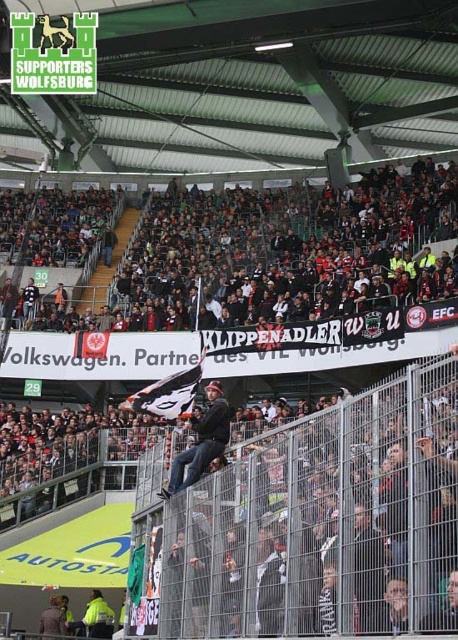
Who is more distant from viewer, (x=235, y=308) or (x=207, y=417)?

Positioned behind is point (x=235, y=308).

Which is in front, point (281, 268) or point (212, 435)?

Point (212, 435) is in front.

What do you see at coordinates (288, 248) in the screenshot? Image resolution: width=458 pixels, height=640 pixels. I see `dark gray fabric crowd at center` at bounding box center [288, 248].

Locate an element on the screen. dark gray fabric crowd at center is located at coordinates (288, 248).

In the scene shown: Does metallic silver fence at center have a lesser height compared to dark gray denim jacket at center?

Incorrect, metallic silver fence at center's height does not fall short of dark gray denim jacket at center's.

Between point (285, 464) and point (196, 426), which one is positioned in front?

Positioned in front is point (285, 464).

Where is `metallic silver fence at center`? The width and height of the screenshot is (458, 640). metallic silver fence at center is located at coordinates (315, 525).

Is metallic silver fence at center to the right of dark gray fabric crowd at center from the viewer's perspective?

Yes, metallic silver fence at center is to the right of dark gray fabric crowd at center.

Does metallic silver fence at center appear under dark gray fabric crowd at center?

Indeed, metallic silver fence at center is positioned under dark gray fabric crowd at center.

Where is `metallic silver fence at center`? The image size is (458, 640). metallic silver fence at center is located at coordinates (315, 525).